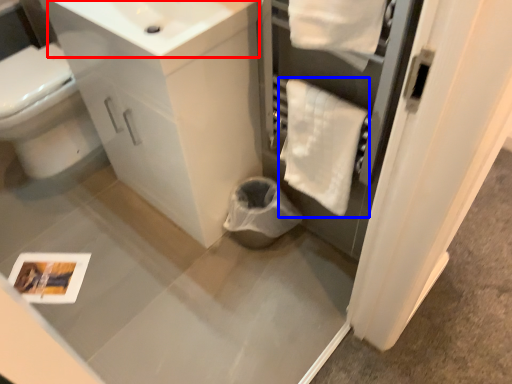
Question: Which object is further to the camera taking this photo, sink (highlighted by a red box) or bath towel (highlighted by a blue box)?

Choices:
 (A) sink
 (B) bath towel

Answer: (B)